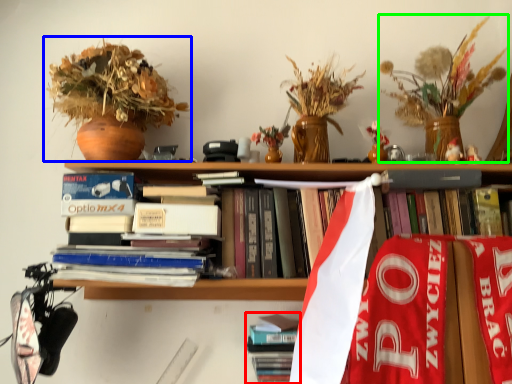
Question: Considering the real-world distances, which object is farthest from book (highlighted by a red box)? houseplant (highlighted by a blue box) or floral arrangement (highlighted by a green box)?

Choices:
 (A) houseplant
 (B) floral arrangement

Answer: (B)